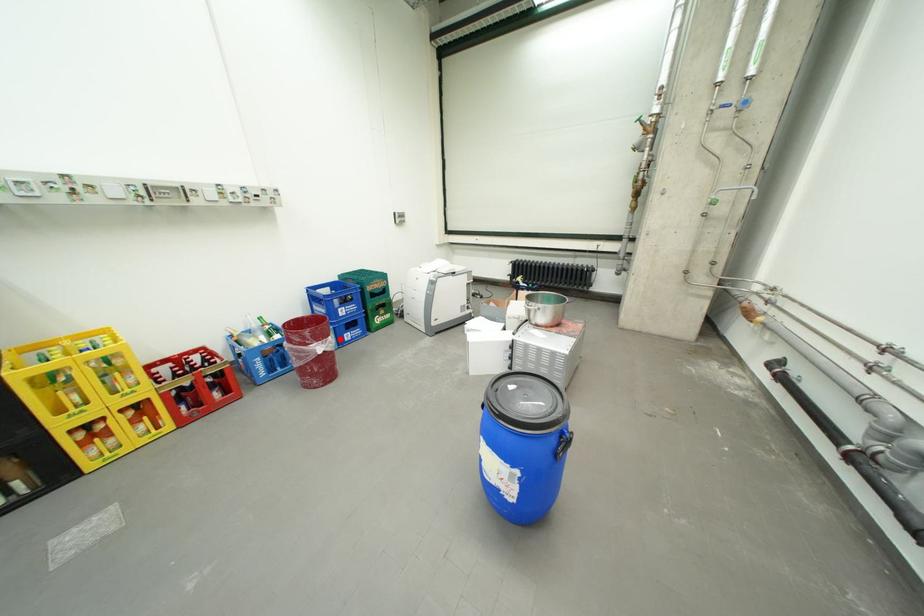
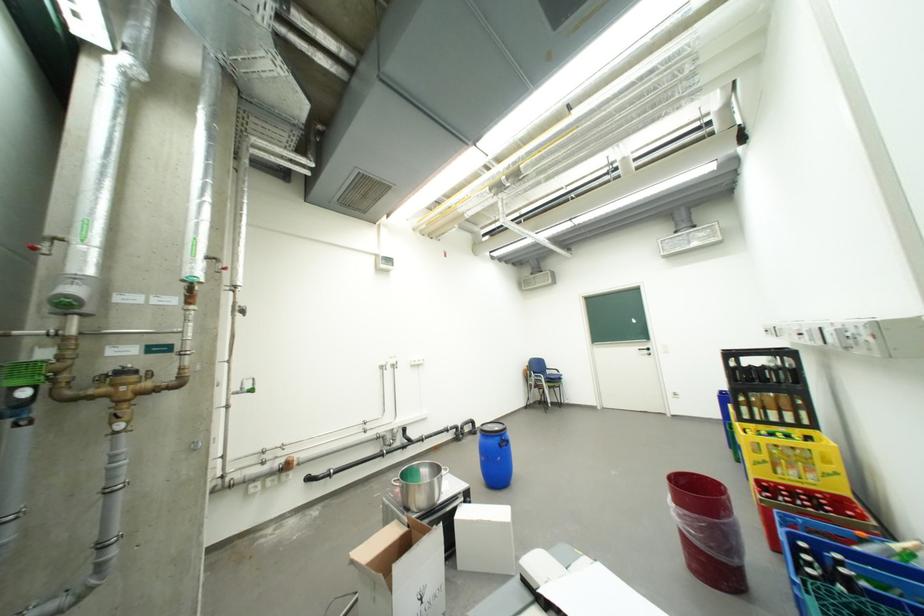
The point at the highlighted location is marked in the first image. Where is the corresponding point in the second image?

(685, 507)